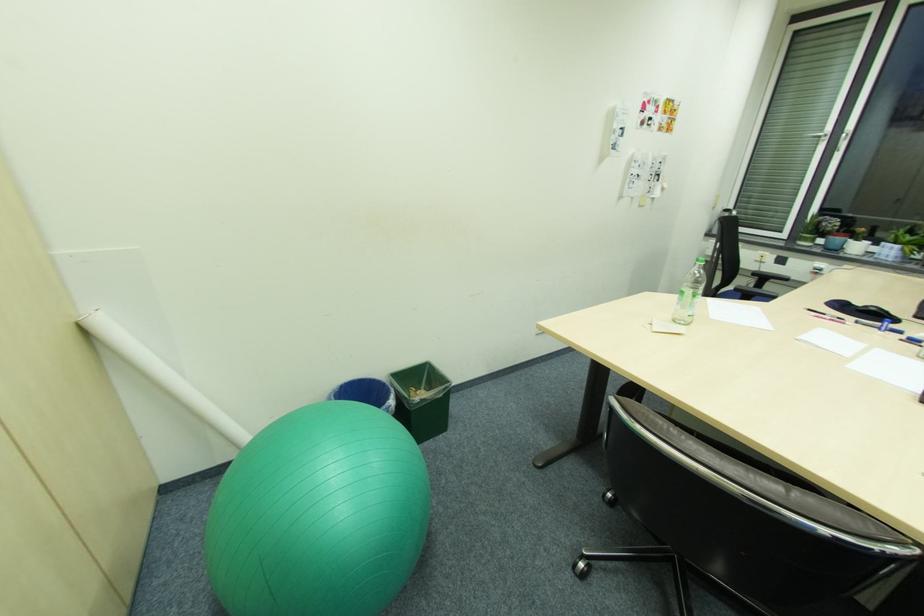
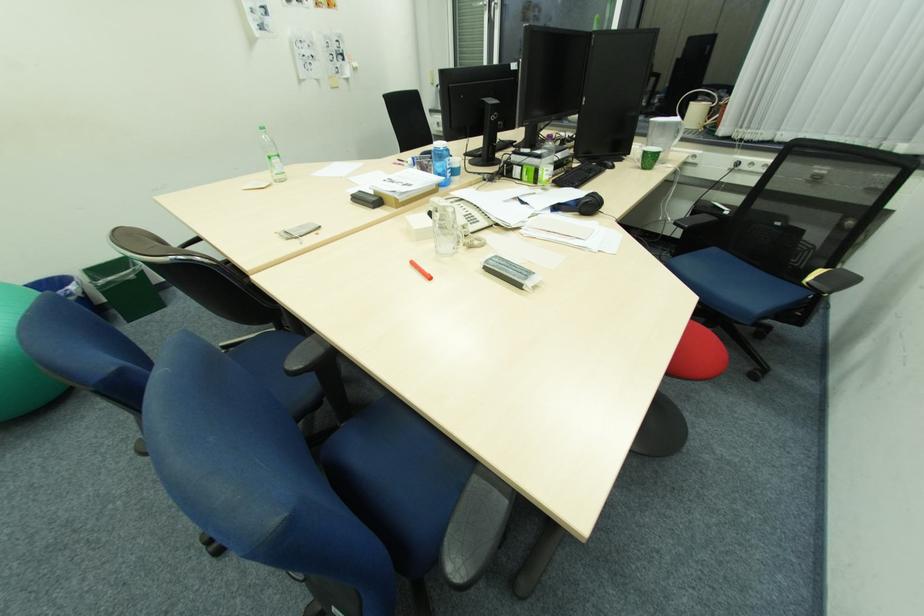
The point at (428, 400) is marked in the first image. Where is the corresponding point in the second image?

(115, 284)